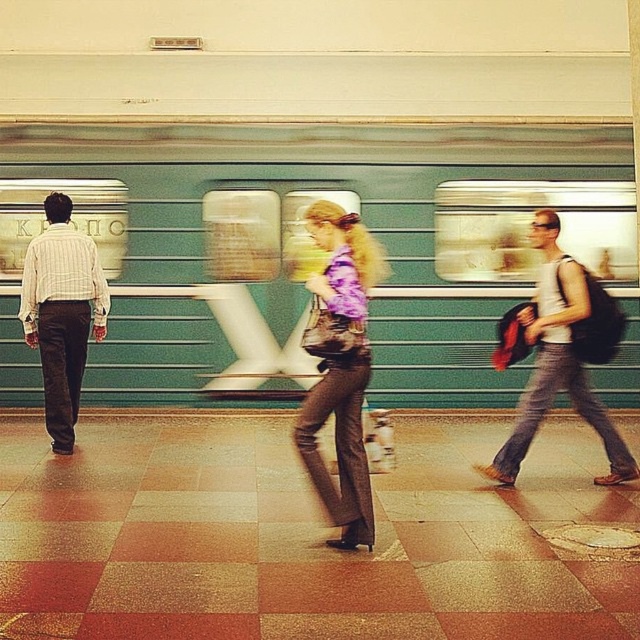
Based on the photo, you are a photographer trying to capture a clear shot of both the white tank top at right and the striped cotton shirt at left. Considering their sizes, which one should you zoom in on first to ensure both fit in the frame?

The white tank top at right is larger in size than the striped cotton shirt at left, so you should zoom in on the striped cotton shirt at left first to accommodate the larger white tank top at right within the frame.

You are standing on the subway platform and want to know how far the point at coordinates (365, 532) is from you. Can you determine the distance?

The point at coordinates (365, 532) is 5.25 meters away from you.